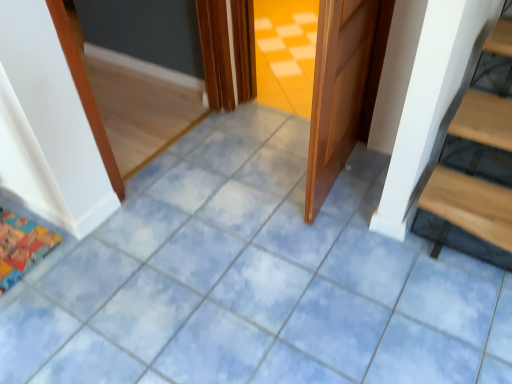
In order to click on free space to the left of brown wooden door at center in this screenshot , I will do `click(229, 196)`.